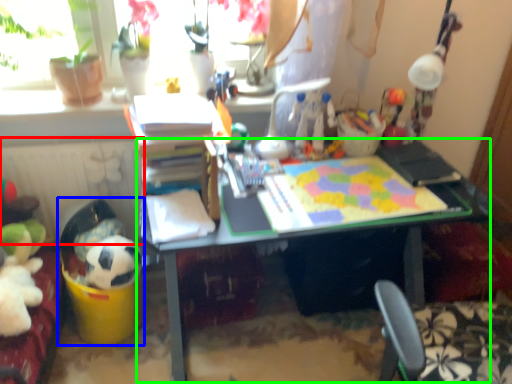
Question: Based on their relative distances, which object is nearer to radiator (highlighted by a red box)? Choose from toy (highlighted by a blue box) and desk (highlighted by a green box).

Choices:
 (A) toy
 (B) desk

Answer: (A)